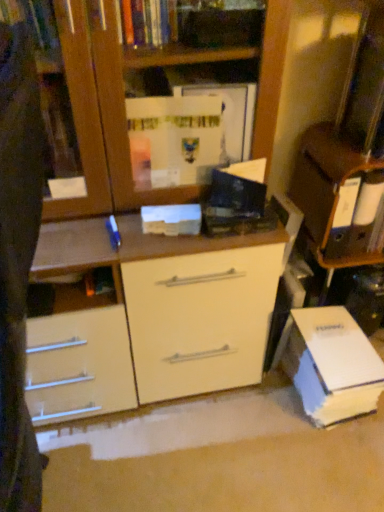
Locate an element on the screen. vacant area that lies in front of white cardboard book at lower right, which ranks as the 2th paperback book in top-to-bottom order is located at coordinates (324, 463).